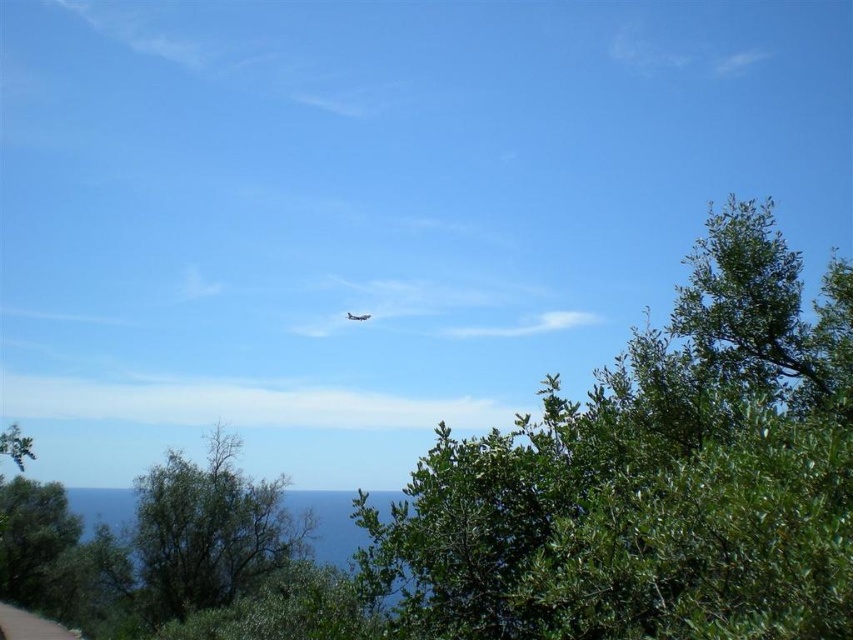
You are standing at the point closest to the camera in the image. Which point, point (722, 420) or point (347, 316), are you currently at?

You are at point (722, 420) because it is closer to the camera than point (347, 316).

You are a bird flying over the coastal scene. You see the green leafy tree at upper center and the metallic silver airplane at center. Which object is taller from your perspective?

The green leafy tree at upper center is taller than the metallic silver airplane at center.

You are standing in a coastal area and see a green leafy tree at lower left and a metallic silver airplane at center. Which object is closer to you?

The green leafy tree at lower left is closer to the viewer than the metallic silver airplane at center.